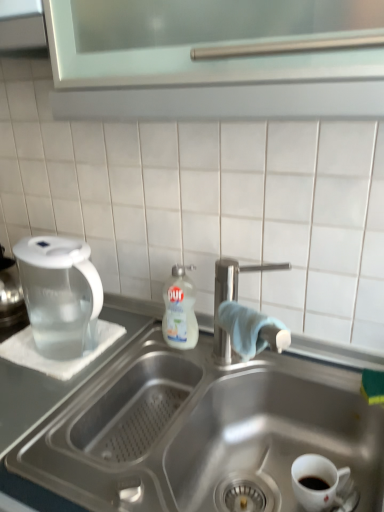
Question: Is white glossy mug at lower right in front of transparent plastic pitcher at left?

Choices:
 (A) yes
 (B) no

Answer: (A)

Question: Is white glossy mug at lower right positioned behind transparent plastic pitcher at left?

Choices:
 (A) yes
 (B) no

Answer: (B)

Question: Can you confirm if white glossy mug at lower right is bigger than transparent plastic pitcher at left?

Choices:
 (A) no
 (B) yes

Answer: (A)

Question: Considering the relative sizes of white glossy mug at lower right and transparent plastic pitcher at left in the image provided, is white glossy mug at lower right wider than transparent plastic pitcher at left?

Choices:
 (A) yes
 (B) no

Answer: (B)

Question: Is white glossy mug at lower right taller than transparent plastic pitcher at left?

Choices:
 (A) no
 (B) yes

Answer: (A)

Question: Based on their positions, is white glossy dish soap at center located to the left or right of white glossy mug at lower right?

Choices:
 (A) left
 (B) right

Answer: (A)

Question: From the image's perspective, is white glossy dish soap at center located above or below white glossy mug at lower right?

Choices:
 (A) above
 (B) below

Answer: (A)

Question: From a real-world perspective, is white glossy dish soap at center positioned above or below white glossy mug at lower right?

Choices:
 (A) below
 (B) above

Answer: (B)

Question: Is point (198, 332) positioned closer to the camera than point (321, 468)?

Choices:
 (A) closer
 (B) farther

Answer: (B)

Question: Considering the relative positions of white glossy mug at lower right and white glossy dish soap at center in the image provided, is white glossy mug at lower right to the left or to the right of white glossy dish soap at center?

Choices:
 (A) right
 (B) left

Answer: (A)

Question: Considering the positions of white glossy mug at lower right and white glossy dish soap at center in the image, is white glossy mug at lower right bigger or smaller than white glossy dish soap at center?

Choices:
 (A) small
 (B) big

Answer: (A)

Question: From the image's perspective, relative to white glossy dish soap at center, is white glossy mug at lower right above or below?

Choices:
 (A) below
 (B) above

Answer: (A)

Question: From a real-world perspective, is white glossy mug at lower right positioned above or below white glossy dish soap at center?

Choices:
 (A) below
 (B) above

Answer: (A)

Question: Based on their positions, is satin nickel faucet at sink center located to the left or right of stainless steel sink at center?

Choices:
 (A) left
 (B) right

Answer: (B)

Question: Choose the correct answer: Is satin nickel faucet at sink center inside stainless steel sink at center or outside it?

Choices:
 (A) outside
 (B) inside

Answer: (A)